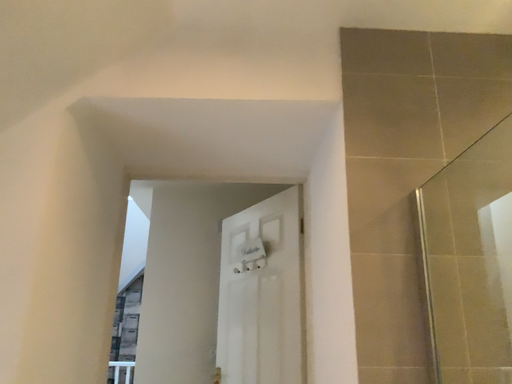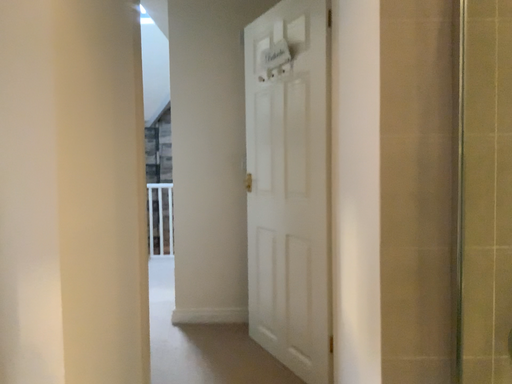
Question: How did the camera likely rotate when shooting the video?

Choices:
 (A) rotated upward
 (B) rotated downward

Answer: (B)